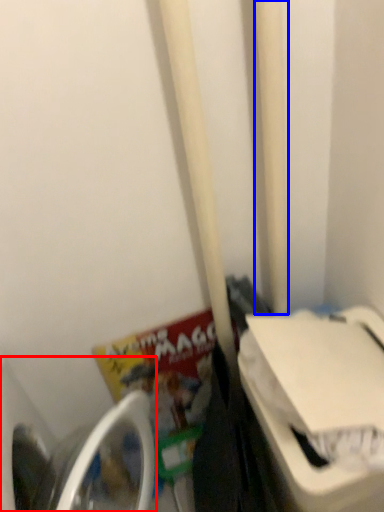
Question: Which object is further to the camera taking this photo, washing machine (highlighted by a red box) or pole (highlighted by a blue box)?

Choices:
 (A) washing machine
 (B) pole

Answer: (B)